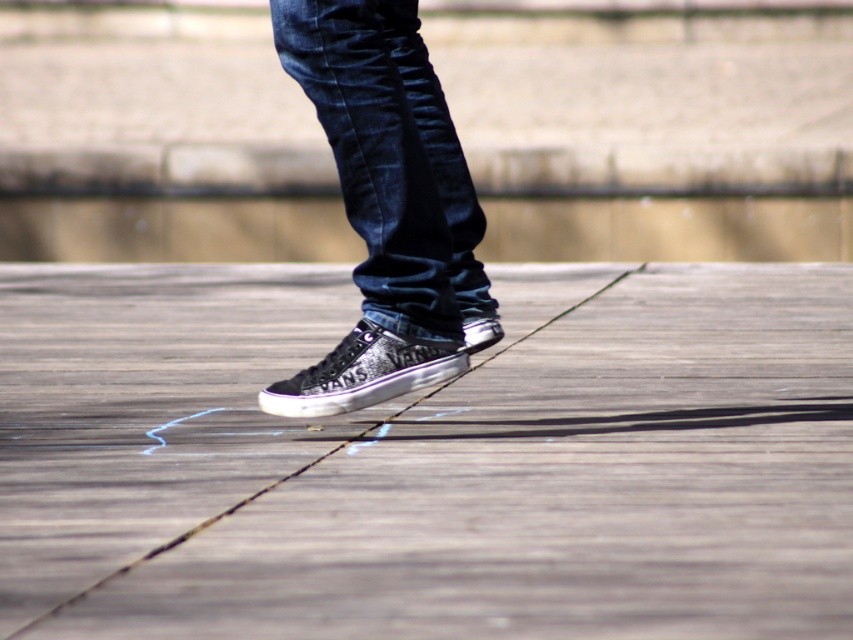
You are standing on the wooden deck and see two points marked on the ground. The first point is at coordinates point (x=363, y=353) and the second is at point (x=486, y=346). If you are facing the direction of the person in the image, which point is closer to you?

Point (x=486, y=346) is closer to you because it is behind point (x=363, y=353), which is in front.

You need to place a rectangular object that is 10 cm wide on the wooden surface. Given the denim at center and the shiny black sneaker at center, which object would allow more space for the object to be placed next to it without overlapping?

The denim at center has a larger width than the shiny black sneaker at center, so placing the 10 cm wide object next to the shiny black sneaker at center would leave more space available.

You are designing a shoe display stand and need to place both the wooden at center and denim at center on it. Given their sizes, which object should be placed first to ensure stability?

The wooden at center should be placed first because its width is larger than the denim at center, providing a stable base for the display.